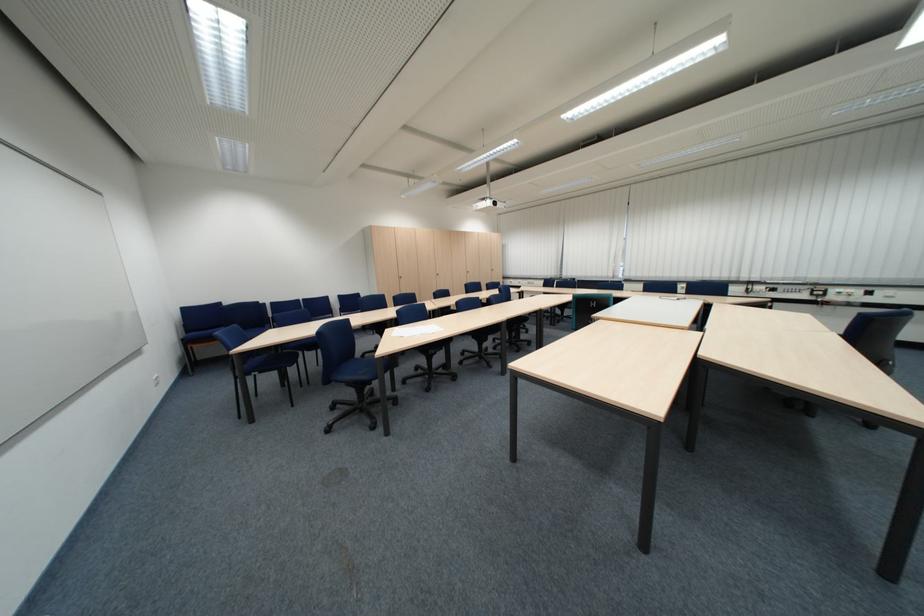
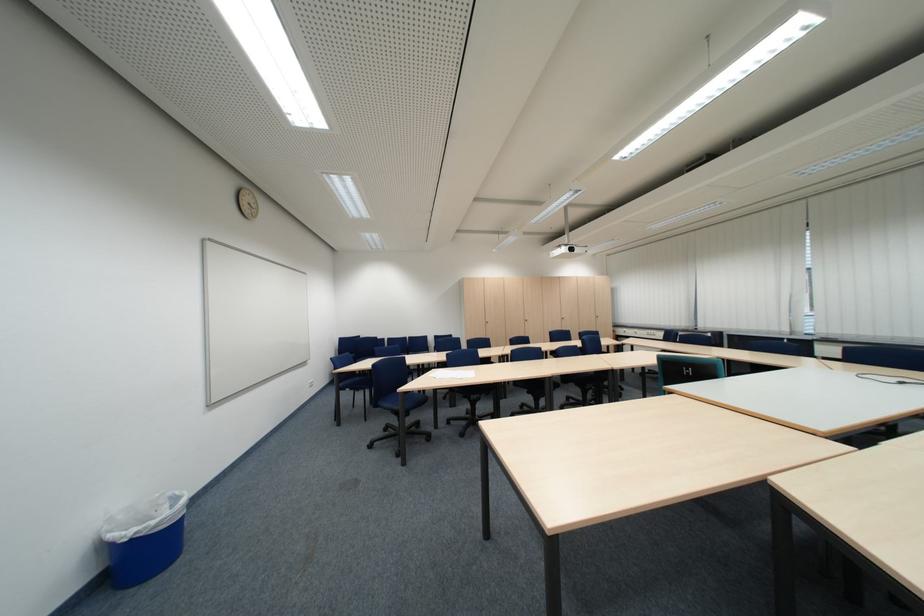
Question: Based on the continuous images, in which direction is the camera rotating? Reply with the corresponding letter.

Choices:
 (A) Left
 (B) Right
 (C) Up
 (D) Down

Answer: (A)